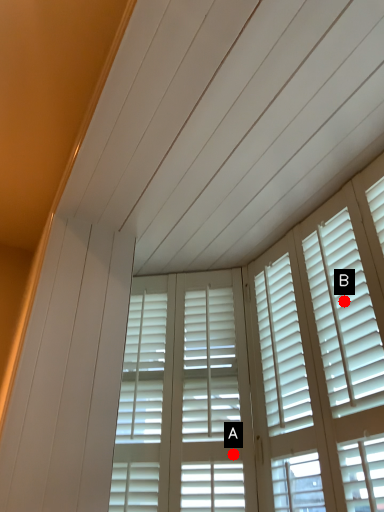
Question: Two points are circled on the image, labeled by A and B beside each circle. Which of the following is the farthest from the observer?

Choices:
 (A) A is further
 (B) B is further

Answer: (A)